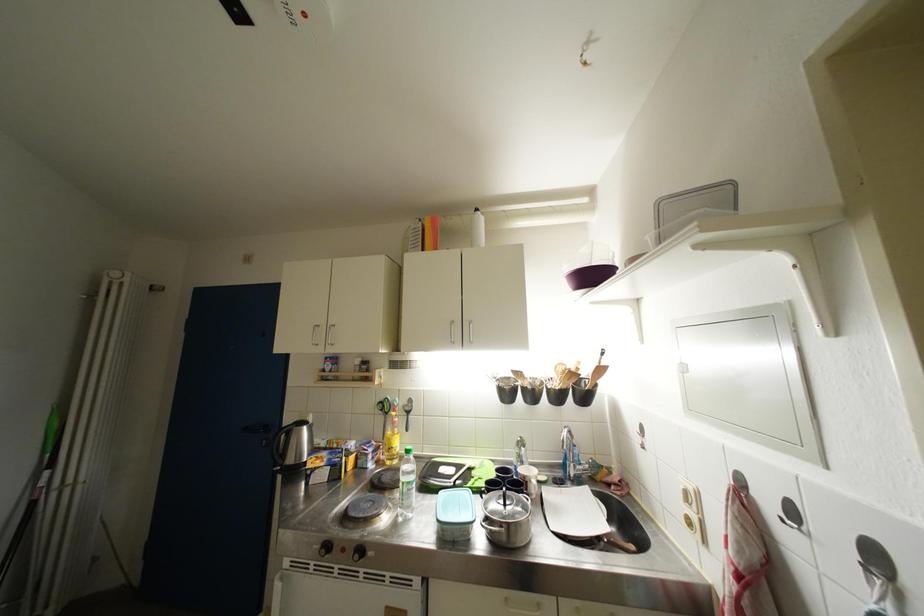
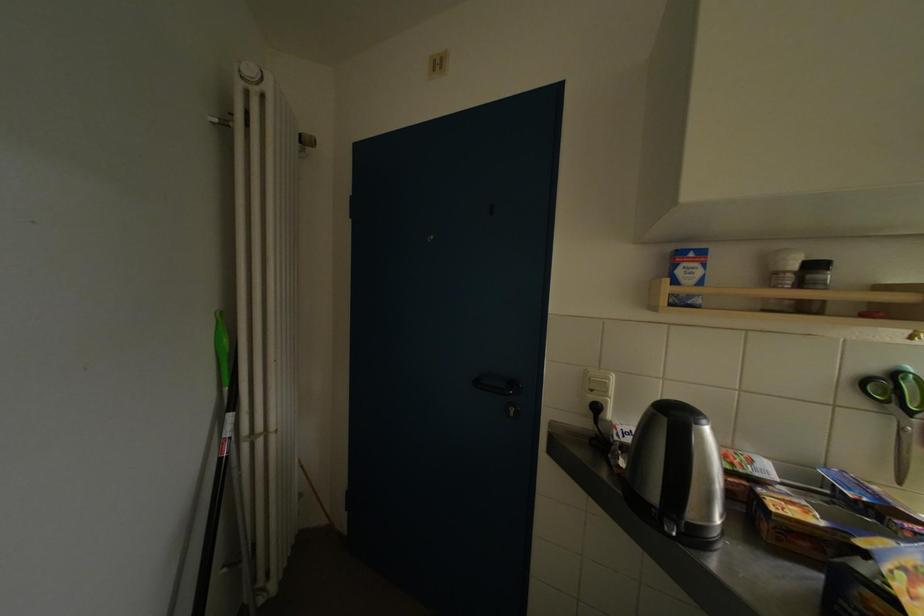
What movement of the cameraman would produce the second image?

The movement direction of the cameraman is left, forward.